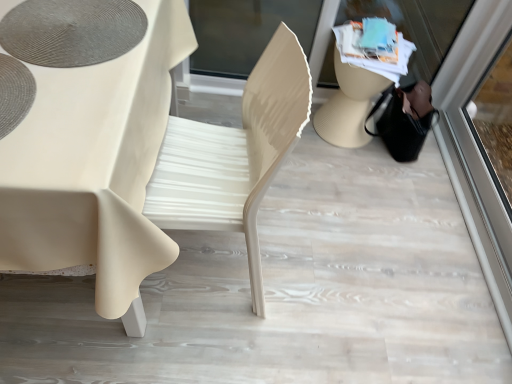
Question: Does transparent glass shop window at upper right lie in front of matte white table at center?

Choices:
 (A) yes
 (B) no

Answer: (B)

Question: Does transparent glass shop window at upper right have a greater height compared to matte white table at center?

Choices:
 (A) no
 (B) yes

Answer: (A)

Question: Can you confirm if transparent glass shop window at upper right is smaller than matte white table at center?

Choices:
 (A) no
 (B) yes

Answer: (B)

Question: From a real-world perspective, is transparent glass shop window at upper right physically below matte white table at center?

Choices:
 (A) yes
 (B) no

Answer: (A)

Question: Does transparent glass shop window at upper right turn towards matte white table at center?

Choices:
 (A) no
 (B) yes

Answer: (B)

Question: From the image's perspective, is transparent glass shop window at upper right above matte white table at center?

Choices:
 (A) yes
 (B) no

Answer: (A)

Question: Considering the relative sizes of matte gray placemat at upper left and transparent glass shop window at upper right in the image provided, is matte gray placemat at upper left shorter than transparent glass shop window at upper right?

Choices:
 (A) yes
 (B) no

Answer: (A)

Question: Is matte gray placemat at upper left oriented away from transparent glass shop window at upper right?

Choices:
 (A) yes
 (B) no

Answer: (B)

Question: Would you say matte gray placemat at upper left is outside transparent glass shop window at upper right?

Choices:
 (A) no
 (B) yes

Answer: (B)

Question: From a real-world perspective, is matte gray placemat at upper left positioned under transparent glass shop window at upper right based on gravity?

Choices:
 (A) no
 (B) yes

Answer: (A)

Question: Is matte gray placemat at upper left further to camera compared to transparent glass shop window at upper right?

Choices:
 (A) yes
 (B) no

Answer: (B)

Question: From a real-world perspective, does matte gray placemat at upper left stand above transparent glass shop window at upper right?

Choices:
 (A) no
 (B) yes

Answer: (B)

Question: From the image's perspective, is transparent glass shop window at upper right under transparent glass screen door at right?

Choices:
 (A) no
 (B) yes

Answer: (A)